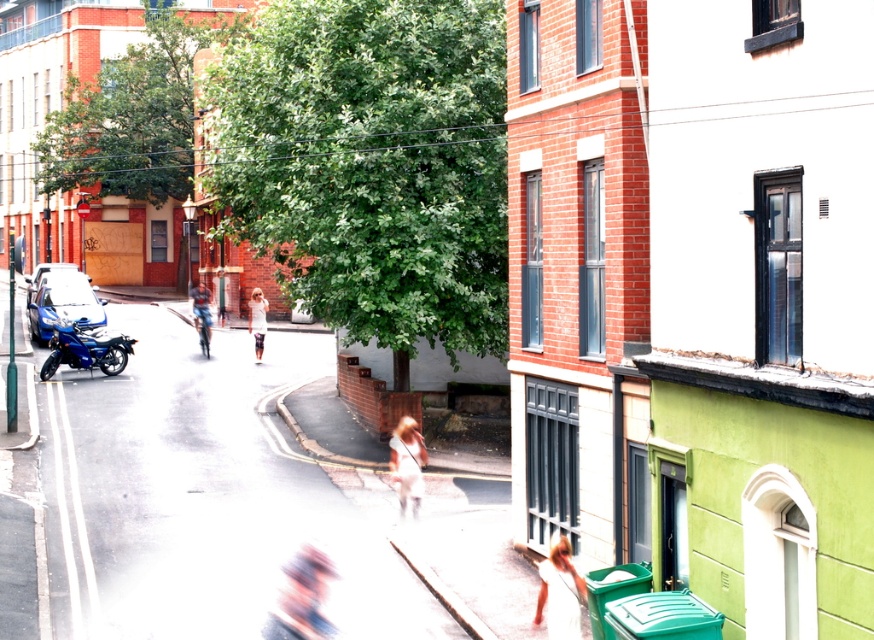
Question: Considering the real-world distances, which object is closest to the white cotton dress at center?

Choices:
 (A) shiny blue motorcycle at left
 (B) white cotton dress at lower right
 (C) light beige pants at center

Answer: (B)

Question: Which point is farther to the camera?

Choices:
 (A) white cotton dress at center
 (B) white cotton dress at lower right
 (C) light beige pants at center
 (D) blue matte motorcycle at left

Answer: (D)

Question: Can you confirm if white concrete pavement at center is positioned to the right of shiny blue motorcycle at left?

Choices:
 (A) no
 (B) yes

Answer: (B)

Question: Which point is farther to the camera?

Choices:
 (A) blue matte motorcycle at left
 (B) blurred fabric headscarf at center
 (C) white concrete pavement at center
 (D) light beige pants at center

Answer: (A)

Question: Is white cotton dress at center to the right of blue matte motorcycle at center-left from the viewer's perspective?

Choices:
 (A) no
 (B) yes

Answer: (B)

Question: Where is white cotton dress at center located in relation to blue matte motorcycle at center-left in the image?

Choices:
 (A) right
 (B) left

Answer: (A)